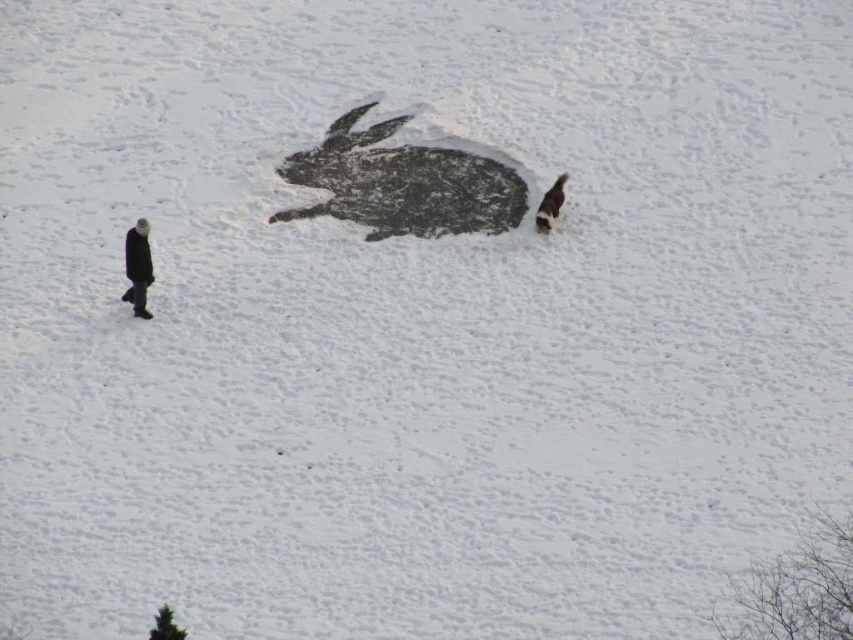
Question: Which object is closer to the camera taking this photo?

Choices:
 (A) black textured snow rabbit at center
 (B) fluffy white dog at right
 (C) dark gray wool coat at left

Answer: (C)

Question: Is dark gray wool coat at left wider than fluffy white dog at right?

Choices:
 (A) yes
 (B) no

Answer: (A)

Question: Which object is the farthest from the fluffy white dog at right?

Choices:
 (A) dark gray wool coat at left
 (B) black textured snow rabbit at center

Answer: (A)

Question: Which of the following is the closest to the observer?

Choices:
 (A) (505, 168)
 (B) (143, 248)

Answer: (B)

Question: Can you confirm if black textured snow rabbit at center is bigger than dark gray wool coat at left?

Choices:
 (A) yes
 (B) no

Answer: (A)

Question: Can you confirm if black textured snow rabbit at center is smaller than dark gray wool coat at left?

Choices:
 (A) yes
 (B) no

Answer: (B)